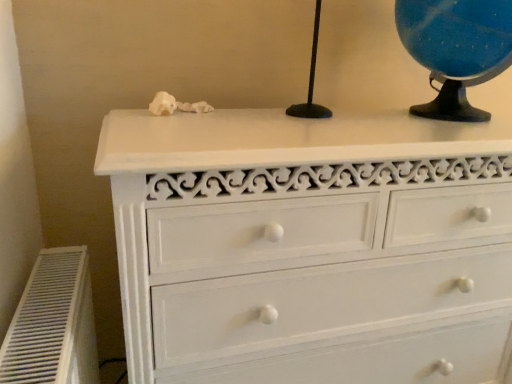
Question: From a real-world perspective, is white plastic air conditioner at lower left physically above matte black globe at upper right?

Choices:
 (A) no
 (B) yes

Answer: (A)

Question: Is white plastic air conditioner at lower left further to camera compared to matte black globe at upper right?

Choices:
 (A) no
 (B) yes

Answer: (A)

Question: Is white plastic air conditioner at lower left placed right next to matte black globe at upper right?

Choices:
 (A) yes
 (B) no

Answer: (B)

Question: Can matte black globe at upper right be found inside white plastic air conditioner at lower left?

Choices:
 (A) yes
 (B) no

Answer: (B)

Question: Considering the relative sizes of white plastic air conditioner at lower left and matte black globe at upper right in the image provided, is white plastic air conditioner at lower left thinner than matte black globe at upper right?

Choices:
 (A) no
 (B) yes

Answer: (B)

Question: From the image's perspective, is white plastic air conditioner at lower left located above or below matte black globe at upper right?

Choices:
 (A) below
 (B) above

Answer: (A)

Question: Considering the positions of point (74, 276) and point (407, 16), is point (74, 276) closer or farther from the camera than point (407, 16)?

Choices:
 (A) closer
 (B) farther

Answer: (A)

Question: Looking at the image, does white plastic air conditioner at lower left seem bigger or smaller compared to matte black globe at upper right?

Choices:
 (A) big
 (B) small

Answer: (A)

Question: Is white plastic air conditioner at lower left spatially inside matte black globe at upper right, or outside of it?

Choices:
 (A) outside
 (B) inside

Answer: (A)

Question: Is white painted wood chest of drawers at upper center spatially inside matte black globe at upper right, or outside of it?

Choices:
 (A) inside
 (B) outside

Answer: (B)

Question: From the image's perspective, relative to matte black globe at upper right, is white painted wood chest of drawers at upper center above or below?

Choices:
 (A) above
 (B) below

Answer: (B)

Question: Considering their positions, is white painted wood chest of drawers at upper center located in front of or behind matte black globe at upper right?

Choices:
 (A) behind
 (B) front

Answer: (B)

Question: From their relative heights in the image, would you say white painted wood chest of drawers at upper center is taller or shorter than matte black globe at upper right?

Choices:
 (A) short
 (B) tall

Answer: (B)

Question: Is white painted wood chest of drawers at upper center in front of or behind white plastic air conditioner at lower left in the image?

Choices:
 (A) front
 (B) behind

Answer: (B)

Question: In terms of size, does white painted wood chest of drawers at upper center appear bigger or smaller than white plastic air conditioner at lower left?

Choices:
 (A) small
 (B) big

Answer: (B)